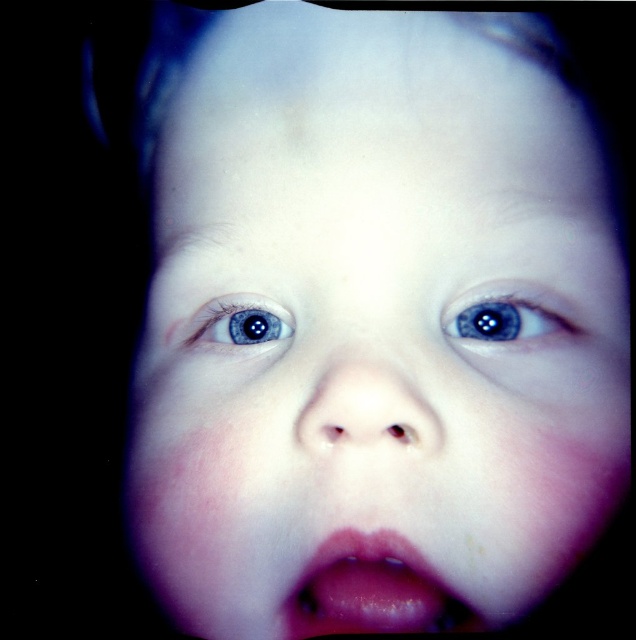
You are an artist preparing to paint a portrait. You observe the pink glossy lips at center and the blue glossy eye at upper left in the image. Which feature should you focus on first if you want to emphasize the subject? Explain your reasoning based on their sizes.

The pink glossy lips at center should be focused on first because its width is larger than the blue glossy eye at upper left, making it a more prominent feature to emphasize.

You are an artist analyzing this portrait. You notice two points marked on the child face. The first point is at coordinate point (462, 301) and the second point is at coordinate point (275, 305). Which of these two points is closer to the viewer?

Point (462, 301) is closer to the viewer than point (275, 305).

Based on the scene description, which object is taller between the pink glossy lips at center and the blue glossy eye at upper left?

The pink glossy lips at center is much taller than the blue glossy eye at upper left according to the description.